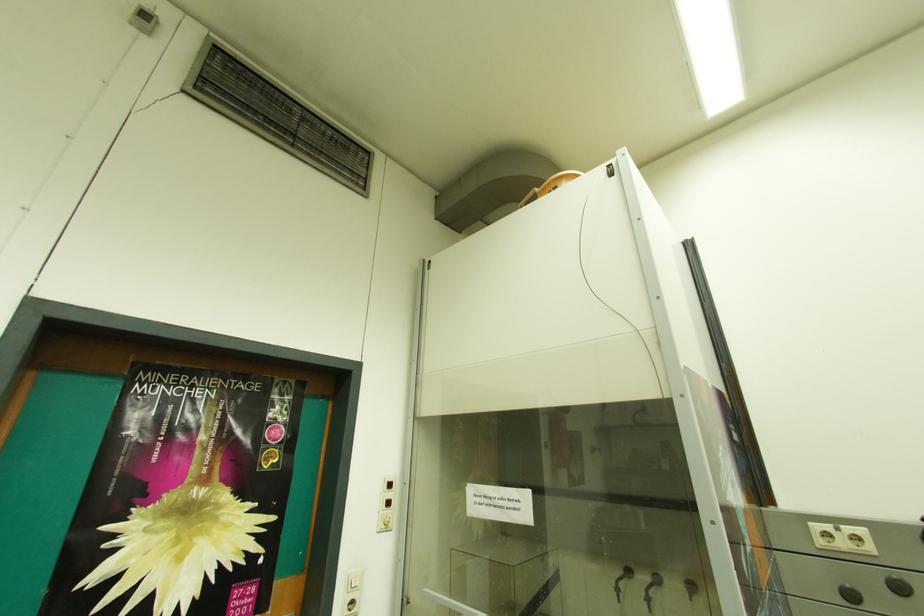
This screenshot has width=924, height=616. Describe the element at coordinates (386, 504) in the screenshot. I see `a white light switch` at that location.